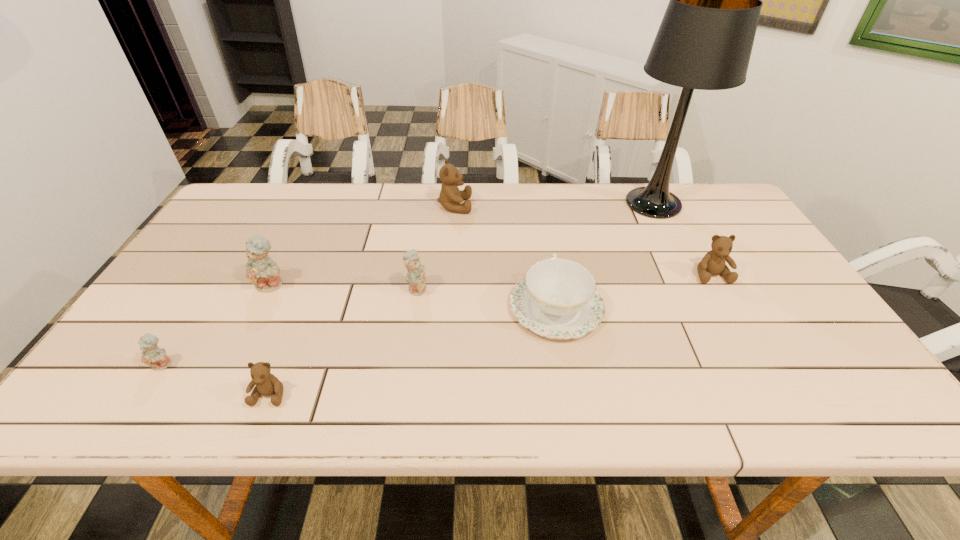
I want to click on vacant point located between the black table lamp and the sixth object from left to right, so click(x=605, y=255).

I want to click on empty space that is in between the farthest brown teddy bear and the second blue teddy bear from right to left, so click(363, 245).

Identify the location of unoccupied position between the biggest brown teddy bear and the second farthest brown teddy bear. The width and height of the screenshot is (960, 540). (583, 240).

Locate an element on the screen. vacant region between the table lamp and the blue chinaware is located at coordinates (605, 255).

Identify which object is located as the sixth nearest to the third teddy bear from left to right. Please provide its 2D coordinates. Your answer should be formatted as a tuple, i.e. [(x, y)], where the tuple contains the x and y coordinates of a point satisfying the conditions above.

[(705, 39)]

Where is `object that is the fourth closest to the leftmost object`? This screenshot has height=540, width=960. object that is the fourth closest to the leftmost object is located at coordinates (557, 299).

Identify which teddy bear is the fourth closest to the fifth teddy bear from right to left. Please provide its 2D coordinates. Your answer should be formatted as a tuple, i.e. [(x, y)], where the tuple contains the x and y coordinates of a point satisfying the conditions above.

[(450, 197)]

Locate an element on the screen. teddy bear that is the fifth closest to the second blue teddy bear from right to left is located at coordinates (713, 263).

Where is `the second closest brown teddy bear relative to the sixth object from left to right`? This screenshot has height=540, width=960. the second closest brown teddy bear relative to the sixth object from left to right is located at coordinates (450, 197).

Locate an element on the screen. The image size is (960, 540). brown teddy bear that stands as the second closest to the nearest blue teddy bear is located at coordinates (450, 197).